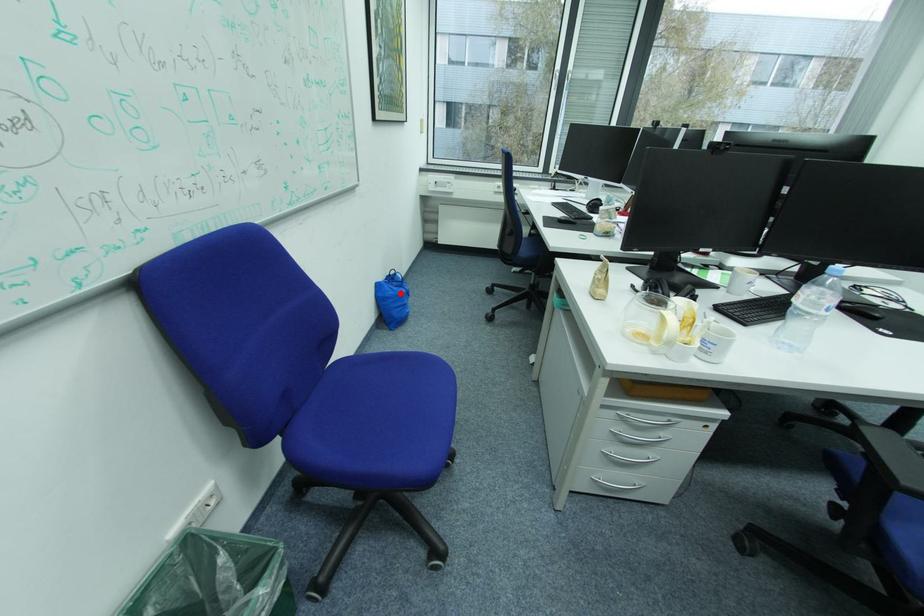
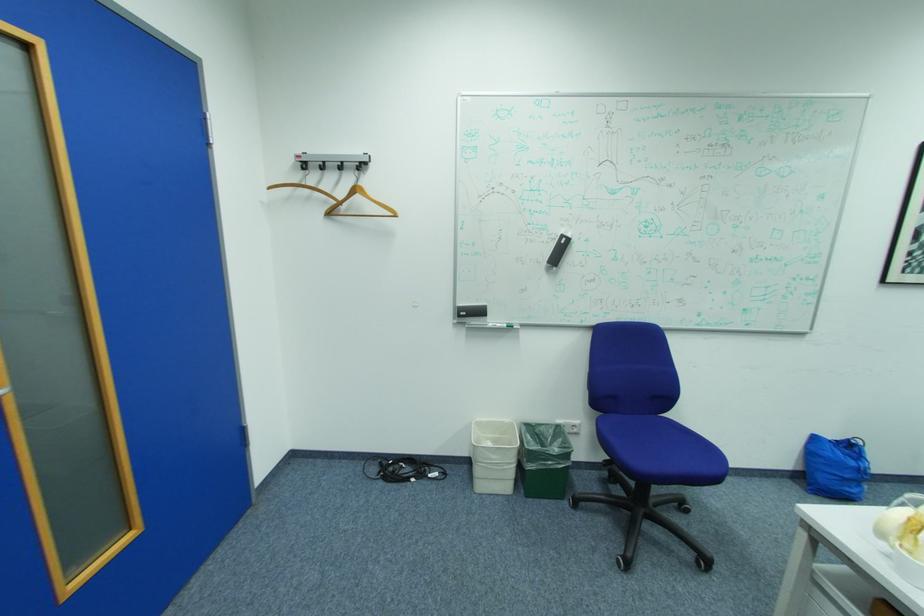
Question: I am providing you with two images of the same scene from different viewpoints. A red point is shown in image1. For the corresponding object point in image2, is it positioned nearer or farther from the camera?

Choices:
 (A) Nearer
 (B) Farther

Answer: (B)